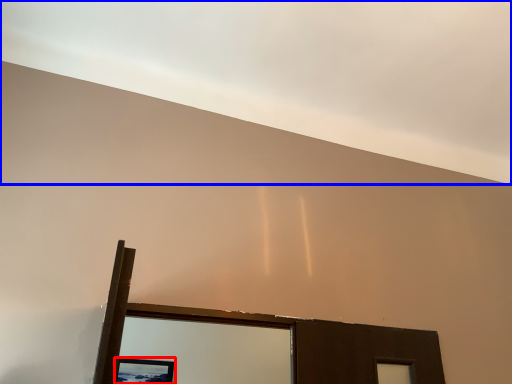
Question: Among these objects, which one is nearest to the camera, picture frame (highlighted by a red box) or cloud (highlighted by a blue box)?

Choices:
 (A) picture frame
 (B) cloud

Answer: (B)